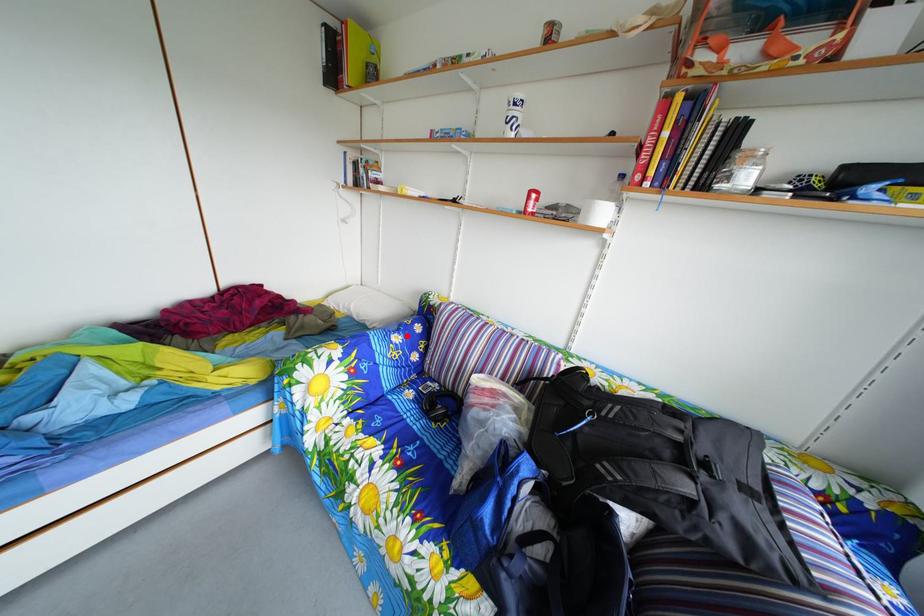
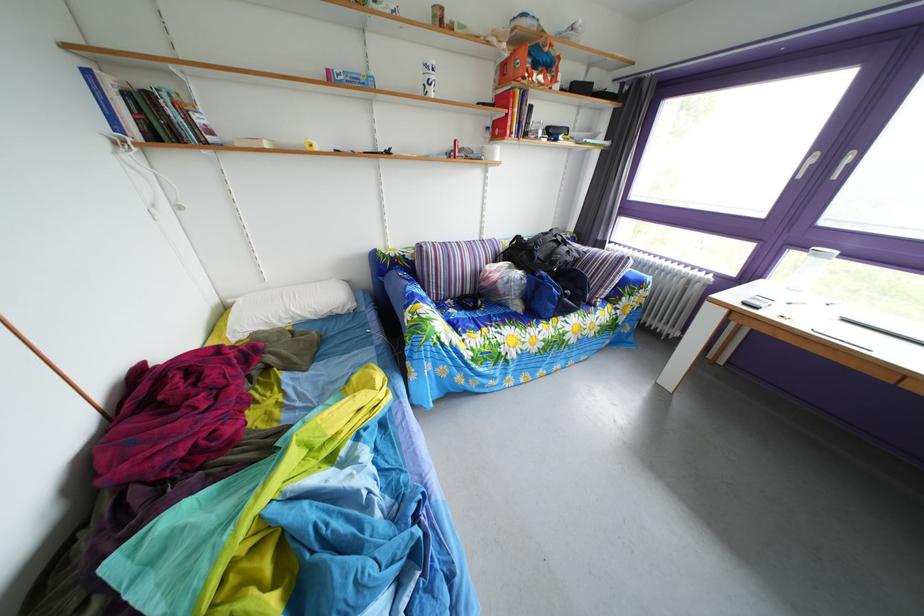
Question: I am providing you with two images of the same scene from different viewpoints. A red point is shown in image1. For the corresponding object point in image2, is it positioned nearer or farther from the camera?

Choices:
 (A) Nearer
 (B) Farther

Answer: (A)